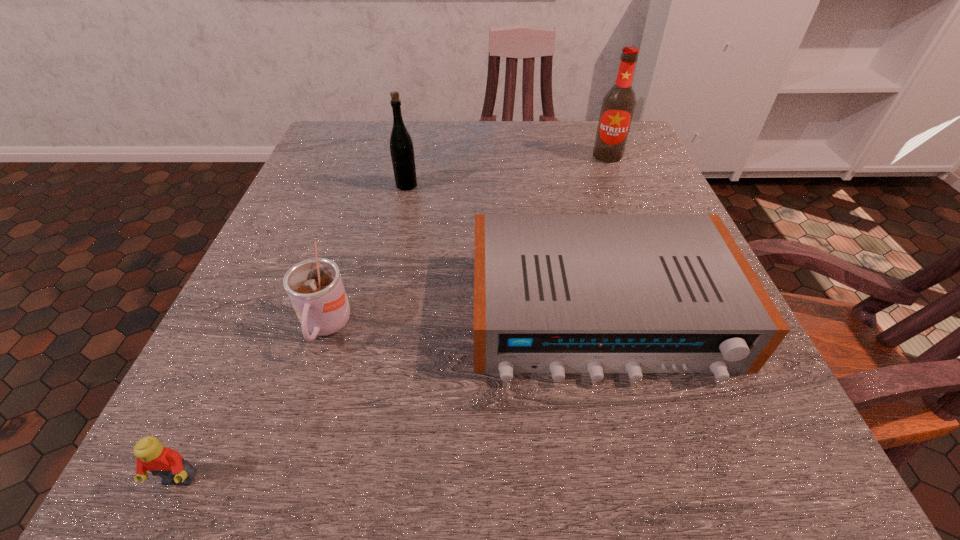
You are a GUI agent. You are given a task and a screenshot of the screen. Output one action in this format:
    pyautogui.click(x=<x>, y=<y>)
    Task: Click on the object that is positioned at the far right corner
    The height and width of the screenshot is (540, 960).
    Given the screenshot: What is the action you would take?
    pyautogui.click(x=618, y=105)

You are a GUI agent. You are given a task and a screenshot of the screen. Output one action in this format:
    pyautogui.click(x=<x>, y=<y>)
    Task: Click on the free region at the far edge
    The image size is (960, 540).
    Given the screenshot: What is the action you would take?
    click(x=418, y=135)

In the image, there is a desktop. Where is `free space at the left edge`? This screenshot has height=540, width=960. free space at the left edge is located at coordinates (300, 383).

The image size is (960, 540). Identify the location of free space at the right edge of the desktop. (591, 193).

Locate an element on the screen. The image size is (960, 540). vacant space at the far left corner of the desktop is located at coordinates (365, 154).

Image resolution: width=960 pixels, height=540 pixels. In order to click on vacant space at the far right corner of the desktop in this screenshot , I will do `click(593, 162)`.

Locate an element on the screen. vacant space at the near right corner of the desktop is located at coordinates (694, 488).

I want to click on blank region between the leftmost object and the farthest object, so click(394, 318).

This screenshot has width=960, height=540. In order to click on free spot between the Lego and the radio receiver in this screenshot , I will do `click(390, 397)`.

Locate an element on the screen. The width and height of the screenshot is (960, 540). vacant space in between the nearest object and the third shortest object is located at coordinates (252, 404).